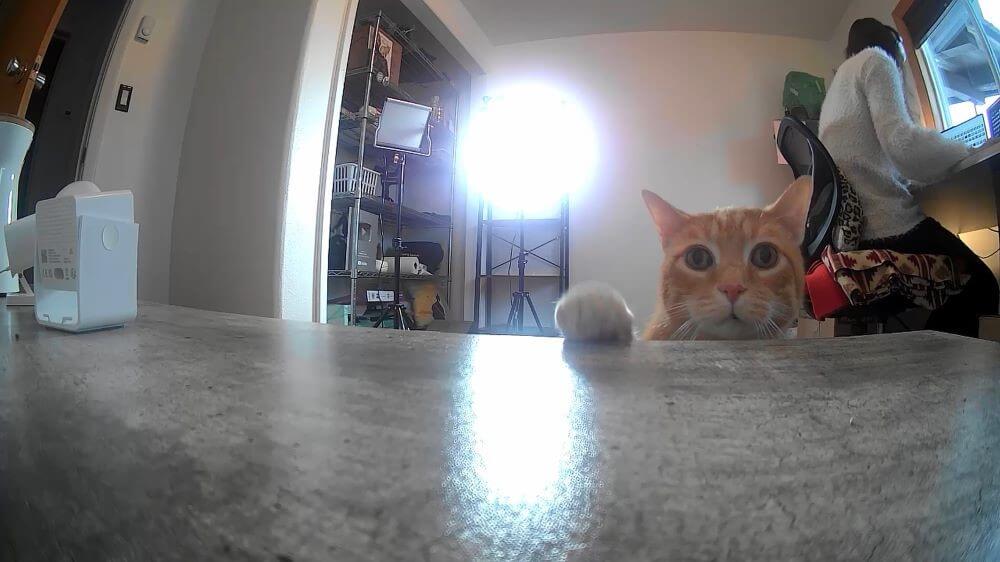
Locate an element on the screen. light switches is located at coordinates (126, 96), (149, 29).